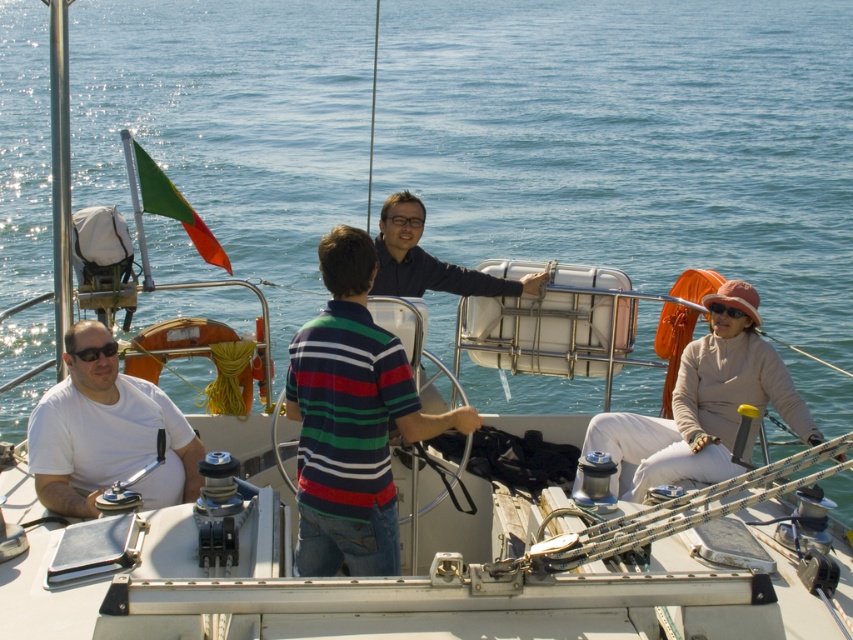
You are a photographer on the sailboat and want to capture a clear photo of both the white matte shirt at left and the black plastic sunglasses at left. Based on their positions, which object should you focus on first to ensure both are in the frame?

The white matte shirt at left is below the black plastic sunglasses at left, so focusing on the black plastic sunglasses at left first would ensure both are within the frame as the shirt is positioned lower.

You are a photographer on the sailboat and want to take a photo of the white matte shirt at left and the black plastic sunglasses at left. The camera has a minimum focus distance of 17 inches. Will both subjects be in focus if you position the camera exactly between them?

The distance between the white matte shirt at left and the black plastic sunglasses at left is 16.91 inches. Since the camera requires a minimum focus distance of 17 inches, positioning it exactly between them would result in a total distance of half that, which is 8.45 inches from each subject. This is below the minimum focus requirement, so the subjects will not be in focus.

You are on a sailboat and want to hand a map to the person wearing the striped cotton shirt at center. You currently have the map in your hand and are standing near the black plastic sunglasses at left. Can you directly hand the map to them without moving your position?

The striped cotton shirt at center is closer to the viewer than the black plastic sunglasses at left, so yes, you can directly hand the map to the striped cotton shirt at center without moving your position because they are in a closer proximity to you.